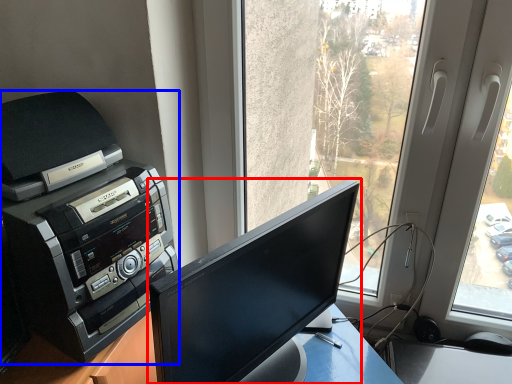
Question: Among these objects, which one is farthest to the camera, computer monitor (highlighted by a red box) or printer (highlighted by a blue box)?

Choices:
 (A) computer monitor
 (B) printer

Answer: (B)